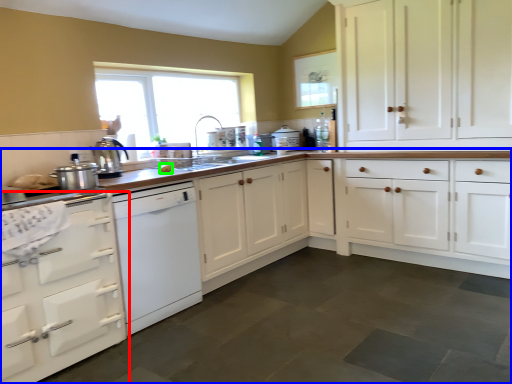
Question: Which object is the farthest from cabinetry (highlighted by a red box)? Choose among these: countertop (highlighted by a blue box) or food (highlighted by a green box).

Choices:
 (A) countertop
 (B) food

Answer: (A)